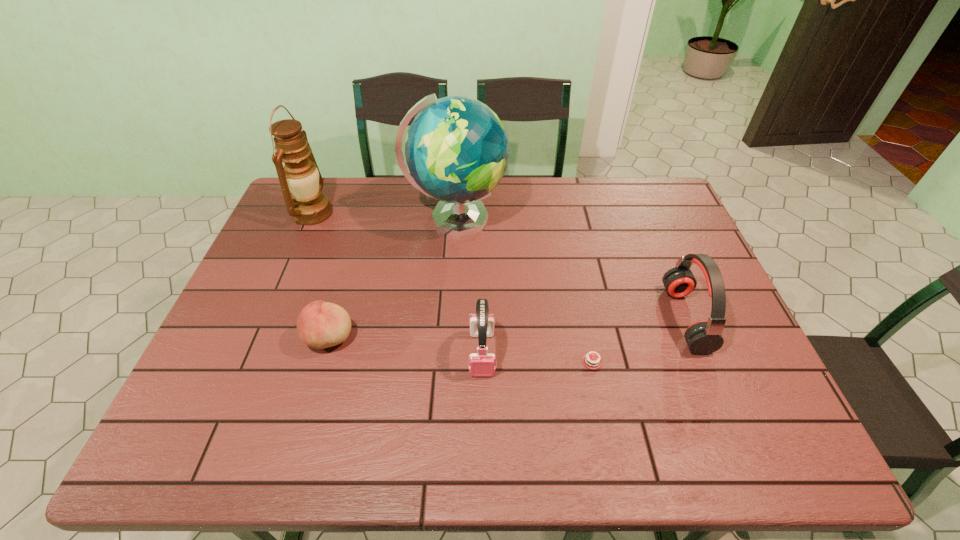
Identify the location of object at the far left corner. This screenshot has height=540, width=960. (308, 206).

Image resolution: width=960 pixels, height=540 pixels. In the image, there is a desktop. Identify the location of vacant space at the far edge. (365, 207).

Where is `vacant space at the left edge`? The width and height of the screenshot is (960, 540). vacant space at the left edge is located at coordinates (276, 349).

I want to click on free space at the right edge, so click(639, 240).

Where is `vacant area at the far right corner`? Image resolution: width=960 pixels, height=540 pixels. vacant area at the far right corner is located at coordinates (670, 217).

Locate an element on the screen. This screenshot has height=540, width=960. blank region between the leftmost object and the shortest object is located at coordinates (452, 287).

I want to click on free point between the shortest object and the left earphone, so click(537, 357).

Find the location of a particular element. The height and width of the screenshot is (540, 960). vacant space that's between the peach and the fifth object from left to right is located at coordinates (461, 349).

I want to click on empty location between the oil lamp and the left earphone, so click(397, 284).

I want to click on empty space between the globe and the right earphone, so click(570, 269).